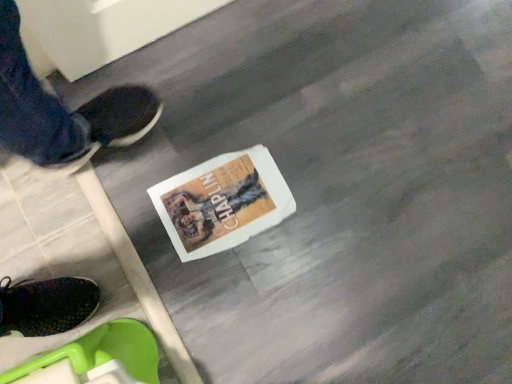
Question: Should I look upward or downward to see white paper magazine at center?

Choices:
 (A) down
 (B) up

Answer: (B)